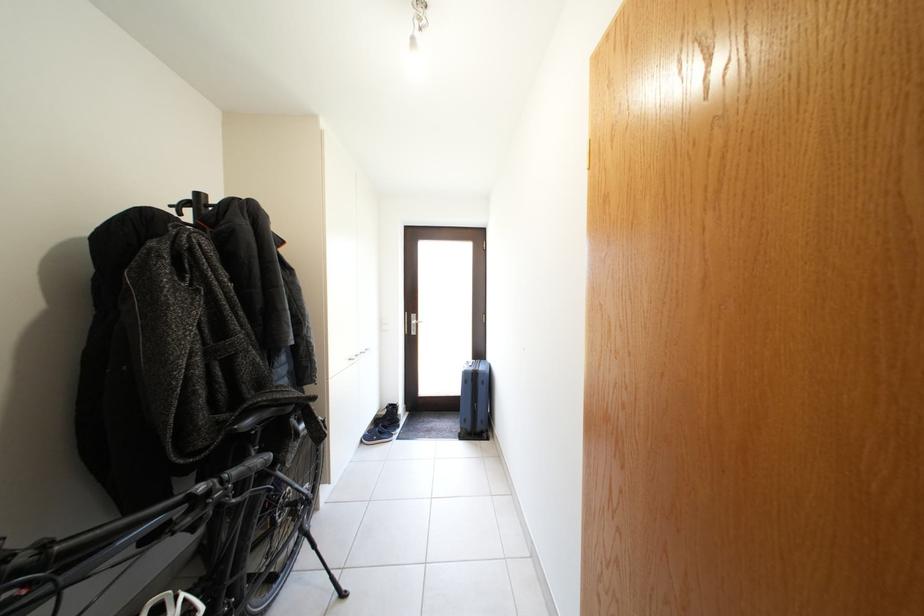
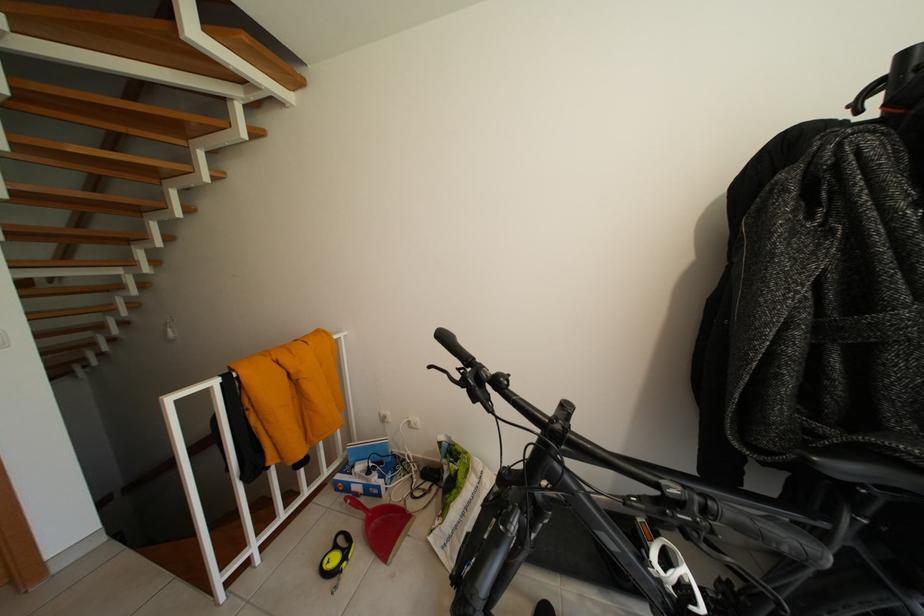
Where in the second image is the point corresponding to [256,429] from the first image?

(852, 474)